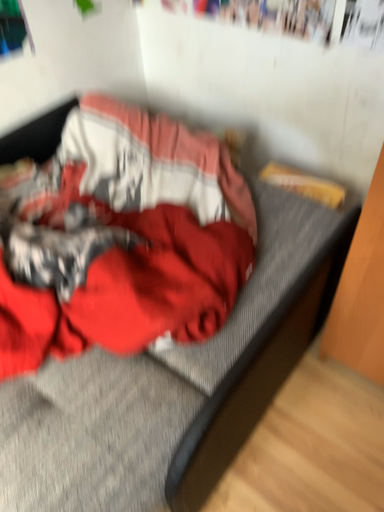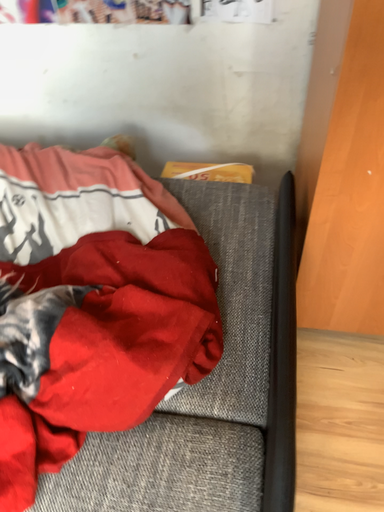
Question: How did the camera likely rotate when shooting the video?

Choices:
 (A) rotated left
 (B) rotated right

Answer: (B)